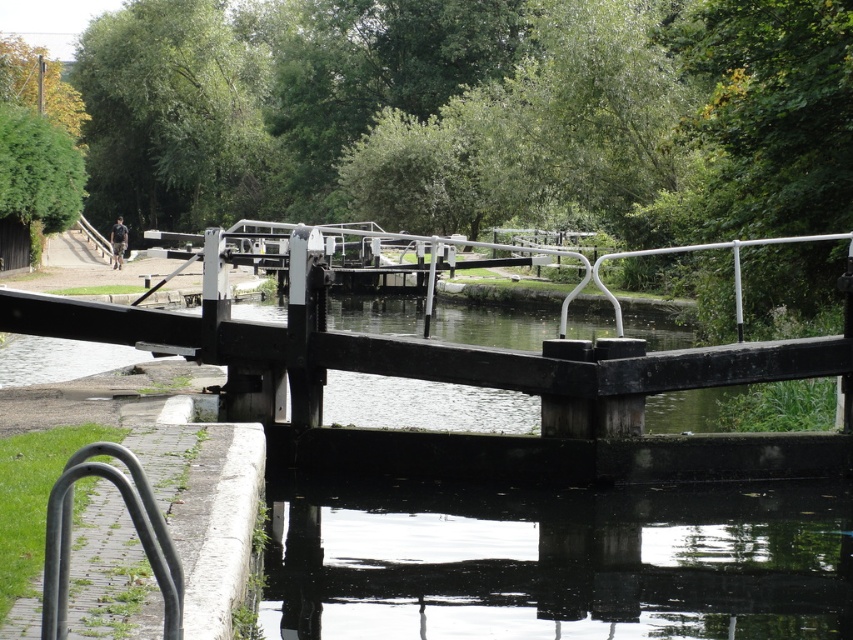
Question: Does transparent water at center have a larger size compared to black metal bike rack at lower left?

Choices:
 (A) yes
 (B) no

Answer: (A)

Question: Is transparent water at center positioned in front of black metal bike rack at lower left?

Choices:
 (A) yes
 (B) no

Answer: (B)

Question: Which point is closer to the camera?

Choices:
 (A) transparent water at center
 (B) smooth white rail at center

Answer: (A)

Question: Which of the following is the closest to the observer?

Choices:
 (A) (212, 328)
 (B) (152, 556)
 (C) (699, 604)

Answer: (B)

Question: Which point appears closest to the camera in this image?

Choices:
 (A) (57, 312)
 (B) (149, 556)

Answer: (B)

Question: In this image, where is transparent water at center located relative to smooth white rail at center?

Choices:
 (A) right
 (B) left

Answer: (A)